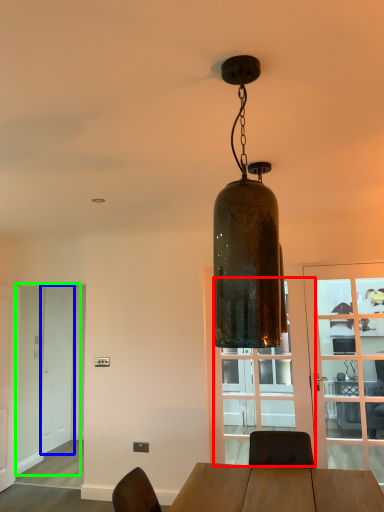
Question: Based on their relative distances, which object is farther from glass door (highlighted by a red box)? Choose from screen door (highlighted by a blue box) and screen door (highlighted by a green box).

Choices:
 (A) screen door
 (B) screen door

Answer: (A)